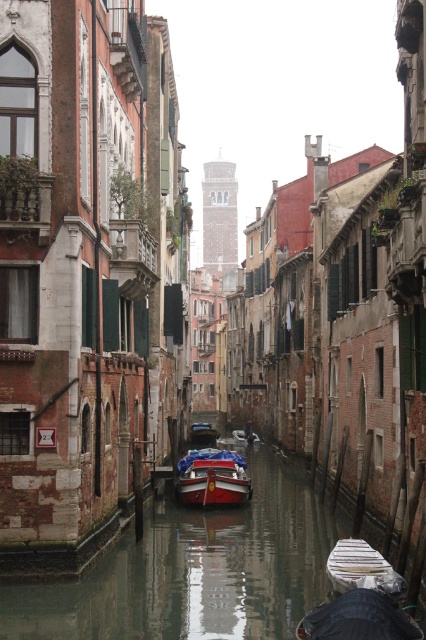
Measure the distance from smooth concrete canal at center to shiny red boat at center.

smooth concrete canal at center is 38.07 feet from shiny red boat at center.

Which is behind, point (172, 522) or point (226, 499)?

The point (226, 499) is more distant.

Is point (279, 493) positioned in front of point (221, 490)?

No, (279, 493) is further to viewer.

In order to click on smooth concrete canal at center in this screenshot , I will do `click(195, 572)`.

Who is positioned more to the left, white plastic boat at center or wooden polished boat at center?

wooden polished boat at center

Who is more distant from viewer, (328,564) or (212,435)?

Positioned behind is point (212,435).

Image resolution: width=426 pixels, height=640 pixels. Identify the location of white plastic boat at center. (362, 570).

Between point (97, 616) and point (362, 572), which one is positioned in front?

Point (362, 572)

Can you confirm if smooth concrete canal at center is thinner than white plastic boat at center?

No.

What do you see at coordinates (195, 572) in the screenshot?
I see `smooth concrete canal at center` at bounding box center [195, 572].

The image size is (426, 640). Identify the location of smooth concrete canal at center. (195, 572).